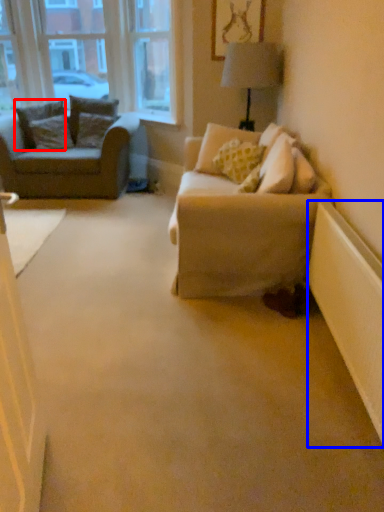
Question: Which object appears closest to the camera in this image, pillow (highlighted by a red box) or radiator (highlighted by a blue box)?

Choices:
 (A) pillow
 (B) radiator

Answer: (B)